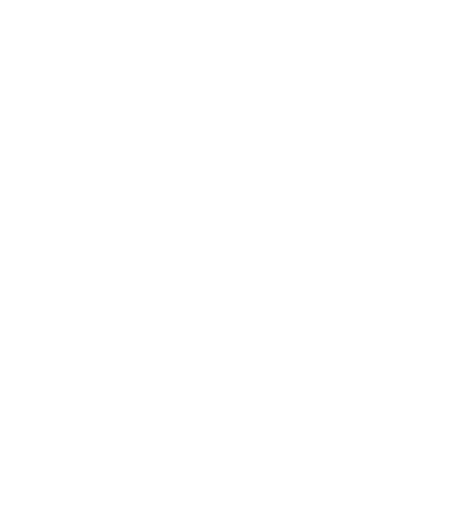
What are the coordinates of `blank screen` in the screenshot? It's located at (230, 233).